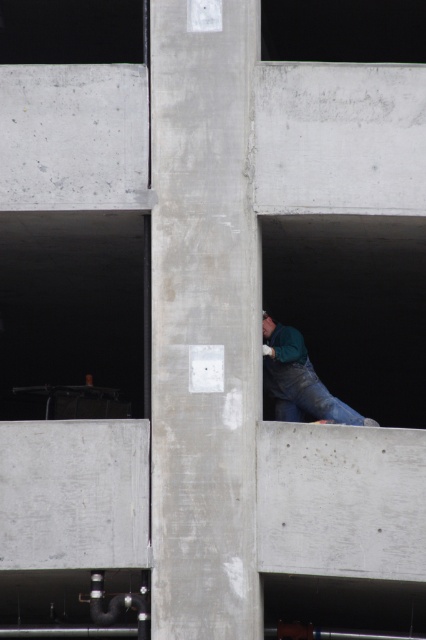
Who is higher up, concrete at center or green matte shirt at upper center?

concrete at center is above.

Which is in front, point (166, 381) or point (276, 387)?

Positioned in front is point (166, 381).

The image size is (426, 640). I want to click on concrete at center, so click(204, 321).

Does concrete at center lie behind blue denim jeans at lower center?

No, concrete at center is closer to the viewer.

Between concrete at center and blue denim jeans at lower center, which one appears on the right side from the viewer's perspective?

blue denim jeans at lower center

Does point (173, 330) come farther from viewer compared to point (262, 369)?

No, (173, 330) is closer to viewer.

Where is `concrete at center`? This screenshot has height=640, width=426. concrete at center is located at coordinates (204, 321).

Between transparent glass window at upper left and blue denim jeans at lower center, which one has more height?

Standing taller between the two is blue denim jeans at lower center.

Describe the element at coordinates (71, 29) in the screenshot. I see `transparent glass window at upper left` at that location.

Where is `transparent glass window at upper left`? transparent glass window at upper left is located at coordinates (71, 29).